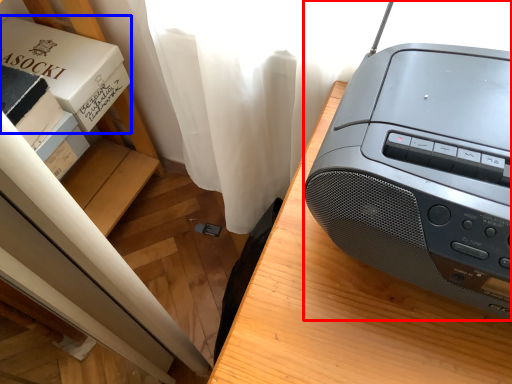
Question: Which point is closer to the camera, printer (highlighted by a red box) or paperback book (highlighted by a blue box)?

Choices:
 (A) printer
 (B) paperback book

Answer: (A)